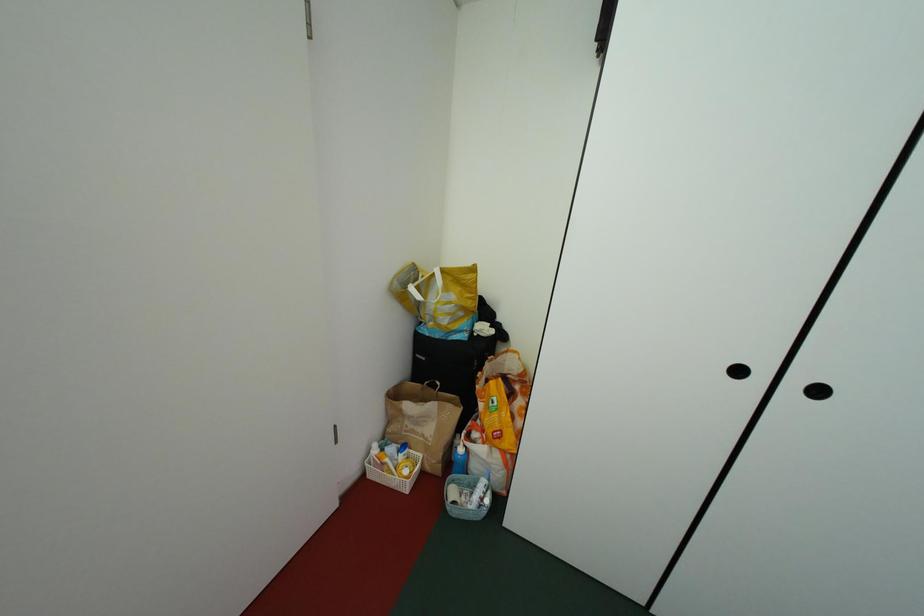
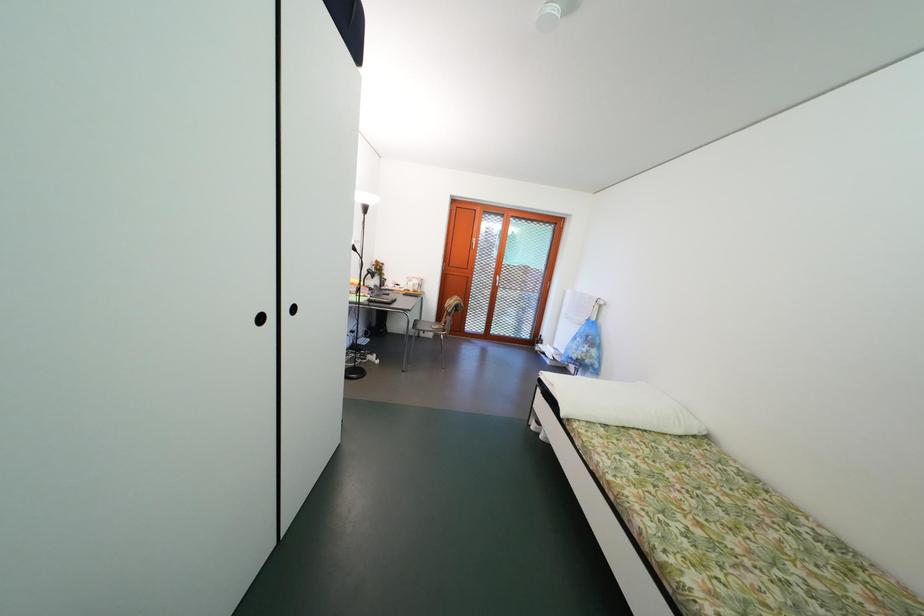
The first image is from the beginning of the video and the second image is from the end. How did the camera likely rotate when shooting the video?

The rotation direction of the camera is right-down.